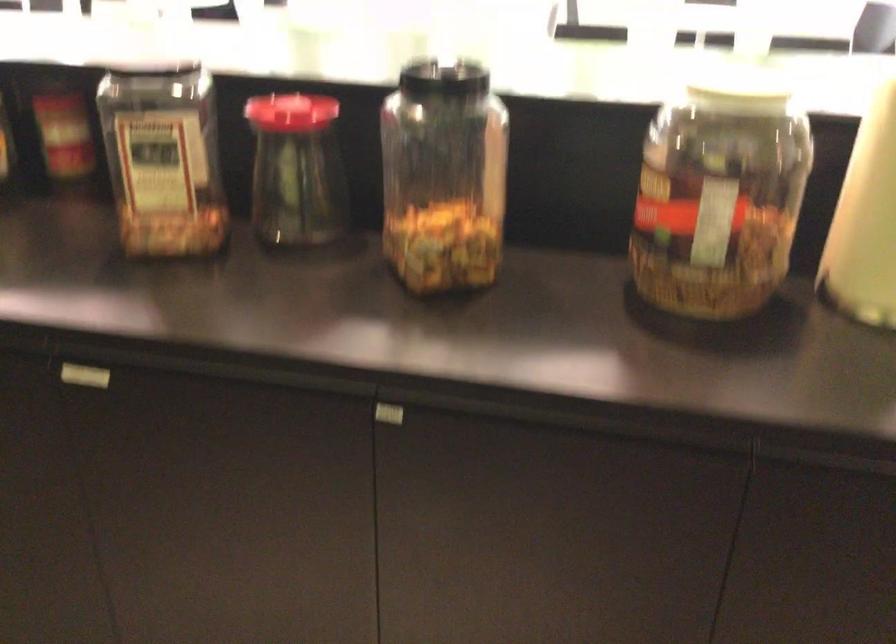
What are the coordinates of `red jar lid` in the screenshot? It's located at (290, 111).